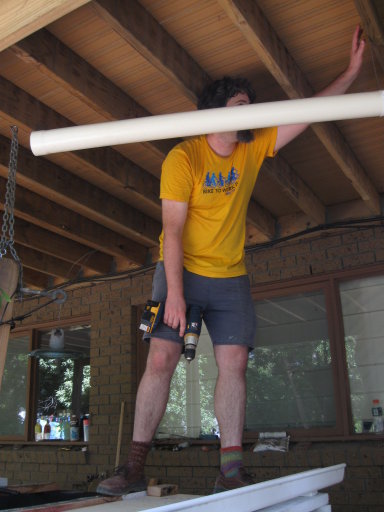
Where is `window`? Image resolution: width=384 pixels, height=512 pixels. window is located at coordinates point(64,368), point(10,385), point(182,399), point(302,346), point(366,345).